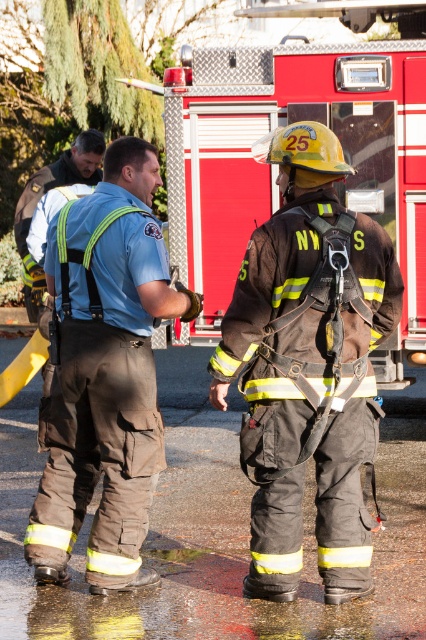
Question: Is black fireman suit at center above brown leather jacket at upper left?

Choices:
 (A) no
 (B) yes

Answer: (A)

Question: Which of the following is the farthest from the observer?

Choices:
 (A) red metallic fire truck at center
 (B) black fireman suit at center
 (C) brown leather jacket at upper left

Answer: (C)

Question: Is brown/canvas pants at center positioned at the back of brown leather jacket at upper left?

Choices:
 (A) yes
 (B) no

Answer: (B)

Question: Estimate the real-world distances between objects in this image. Which object is closer to the black fireman suit at center?

Choices:
 (A) brown leather jacket at upper left
 (B) red metallic fire truck at center

Answer: (B)

Question: Observing the image, what is the correct spatial positioning of black fireman suit at center in reference to brown/canvas pants at center?

Choices:
 (A) below
 (B) above

Answer: (A)

Question: Which of the following is the farthest from the observer?

Choices:
 (A) brown leather jacket at upper left
 (B) black fireman suit at center
 (C) red metallic fire truck at center

Answer: (A)